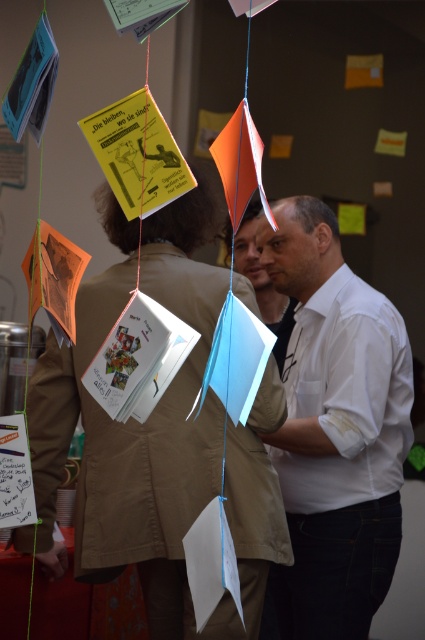
Question: Which point is farther to the camera?

Choices:
 (A) white matte shirt at center
 (B) khaki cotton jacket at center

Answer: (A)

Question: Which of the following is the farthest from the observer?

Choices:
 (A) khaki cotton jacket at center
 (B) white matte shirt at center

Answer: (B)

Question: In this image, where is khaki cotton jacket at center located relative to white matte shirt at center?

Choices:
 (A) below
 (B) above

Answer: (B)

Question: Does khaki cotton jacket at center lie behind white matte shirt at center?

Choices:
 (A) no
 (B) yes

Answer: (A)

Question: Which point is farther from the camera taking this photo?

Choices:
 (A) (297, 392)
 (B) (246, 433)

Answer: (A)

Question: Is khaki cotton jacket at center wider than white matte shirt at center?

Choices:
 (A) yes
 (B) no

Answer: (A)